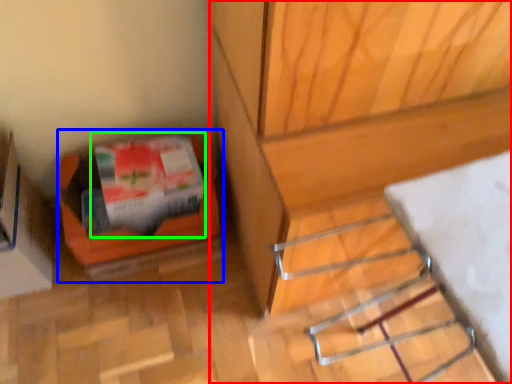
Question: Based on their relative distances, which object is nearer to furniture (highlighted by a red box)? Choose from box (highlighted by a blue box) and wrapping paper (highlighted by a green box).

Choices:
 (A) box
 (B) wrapping paper

Answer: (B)